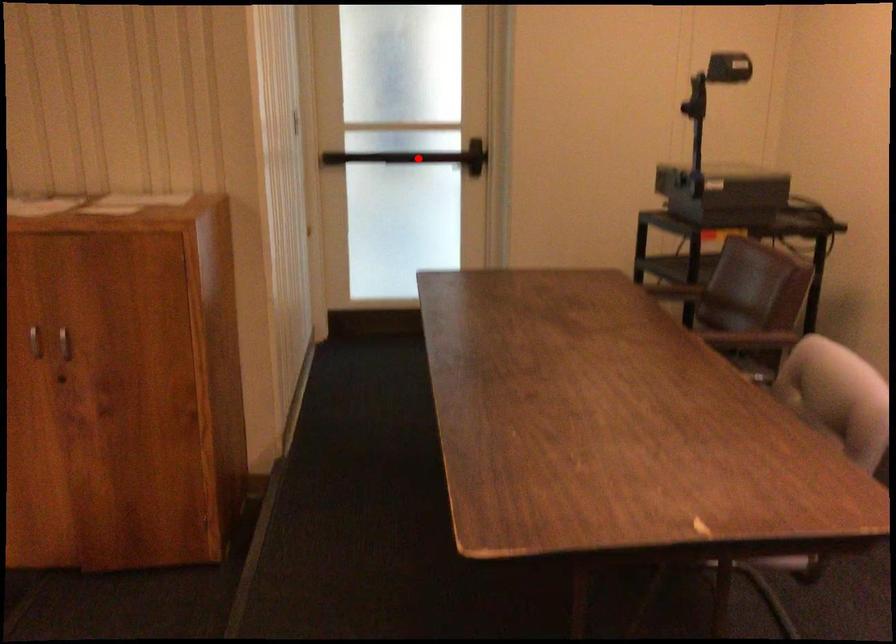
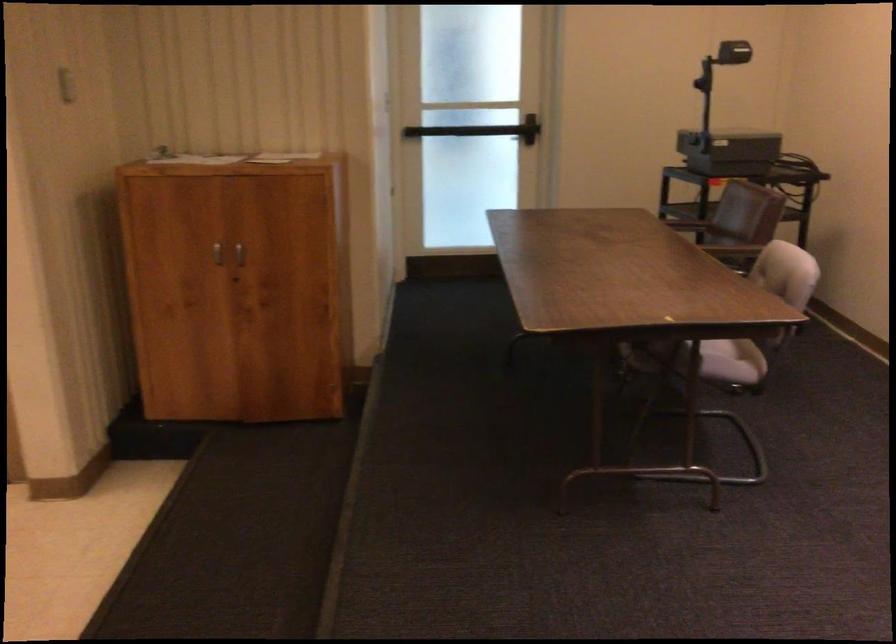
Question: I am providing you with two images of the same scene from different viewpoints. A red point is shown in image1. For the corresponding object point in image2, is it positioned nearer or farther from the camera?

Choices:
 (A) Nearer
 (B) Farther

Answer: (B)